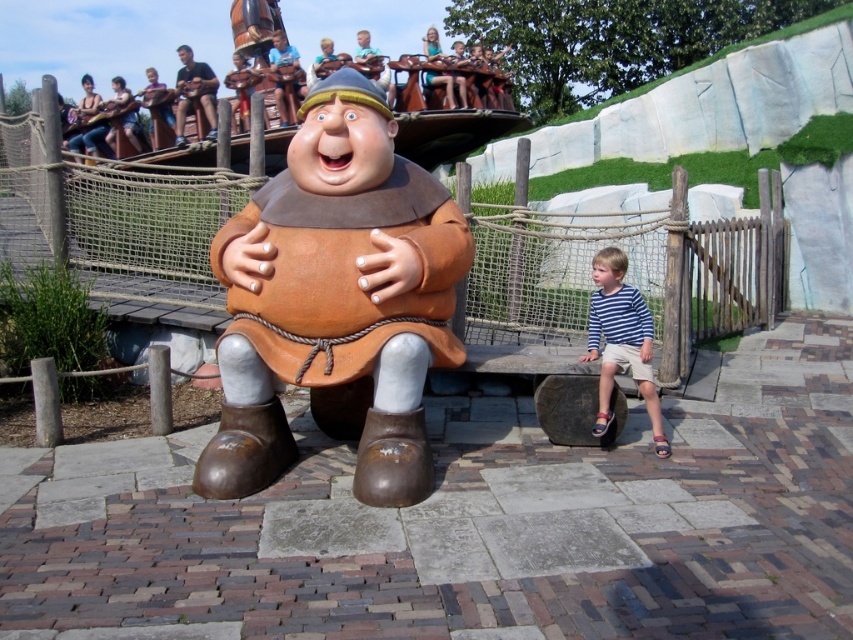
Is point (633, 340) farther from viewer compared to point (199, 72)?

No, it is in front of (199, 72).

Which is above, blue striped shirt at lower right or dark blue t-shirt at upper left?

A: dark blue t-shirt at upper left is higher up.

Is point (619, 317) closer to viewer compared to point (210, 70)?

Yes, it is.

You are a GUI agent. You are given a task and a screenshot of the screen. Output one action in this format:
    pyautogui.click(x=<x>, y=<y>)
    Task: Click on the blue striped shirt at lower right
    The width and height of the screenshot is (853, 640).
    Given the screenshot: What is the action you would take?
    pyautogui.click(x=621, y=340)

Is brown matte statue at center to the left of blue striped shirt at lower right from the viewer's perspective?

Indeed, brown matte statue at center is positioned on the left side of blue striped shirt at lower right.

Between point (221, 424) and point (660, 449), which one is positioned behind?

Point (660, 449)

This screenshot has width=853, height=640. Identify the location of brown matte statue at center. (335, 301).

Who is more distant from viewer, (271, 477) or (212, 106)?

The point (212, 106) is more distant.

Can you confirm if brown matte statue at center is positioned below dark blue t-shirt at upper left?

Yes.

The width and height of the screenshot is (853, 640). Find the location of `brown matte statue at center`. brown matte statue at center is located at coordinates (335, 301).